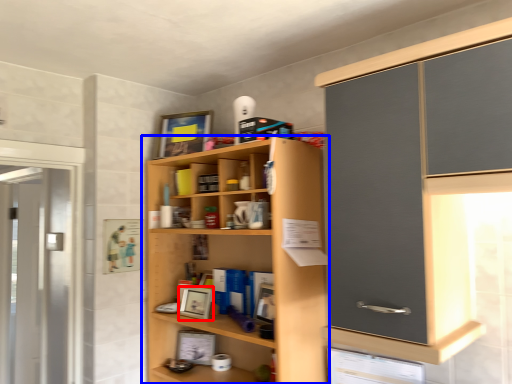
Question: Which point is closer to the camera, picture frame (highlighted by a red box) or cupboard (highlighted by a blue box)?

Choices:
 (A) picture frame
 (B) cupboard

Answer: (B)